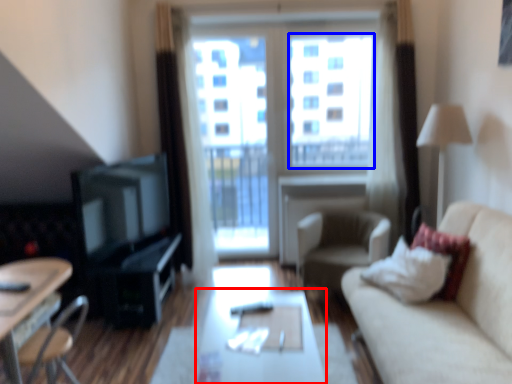
Question: Which object is closer to the camera taking this photo, table (highlighted by a red box) or window screen (highlighted by a blue box)?

Choices:
 (A) table
 (B) window screen

Answer: (A)